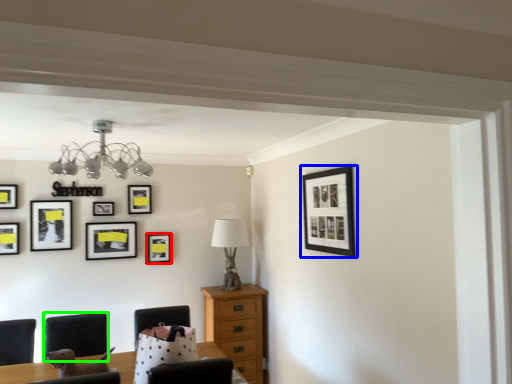
Question: Estimate the real-world distances between objects in this image. Which object is closer to picture frame (highlighted by a red box), picture frame (highlighted by a blue box) or armchair (highlighted by a green box)?

Choices:
 (A) picture frame
 (B) armchair

Answer: (B)